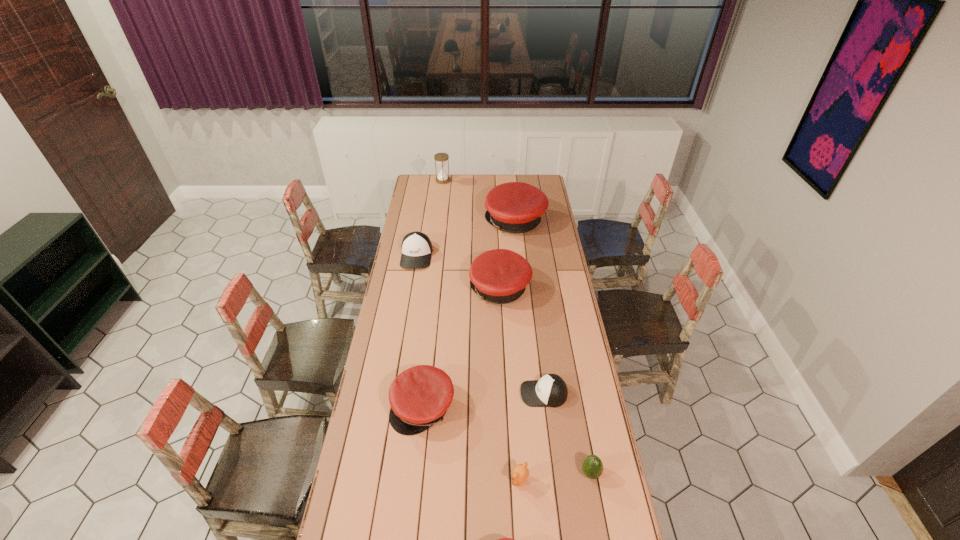
Find the location of `object located at the far edge`. object located at the far edge is located at coordinates (441, 158).

Locate an element on the screen. hourglass positioned at the left edge is located at coordinates (441, 158).

What are the coordinates of `avocado that is at the right edge` in the screenshot? It's located at (592, 467).

The width and height of the screenshot is (960, 540). Identify the location of object at the far left corner. (441, 158).

Find the location of a particular element. The width and height of the screenshot is (960, 540). vacant region at the left edge is located at coordinates (389, 513).

This screenshot has width=960, height=540. In the image, there is a desktop. Find the location of `vacant space at the right edge`. vacant space at the right edge is located at coordinates (543, 303).

Find the location of a particular element. Image resolution: width=960 pixels, height=540 pixels. free area in between the leftmost red cap and the third tallest object is located at coordinates (462, 348).

The height and width of the screenshot is (540, 960). Identify the location of free spot between the hourglass and the third biggest red cap. (433, 294).

Identify the location of vacant region between the brown teddy bear and the bigger gray cap. (468, 368).

Where is `free point between the avocado and the leftmost red cap`? The image size is (960, 540). free point between the avocado and the leftmost red cap is located at coordinates (507, 440).